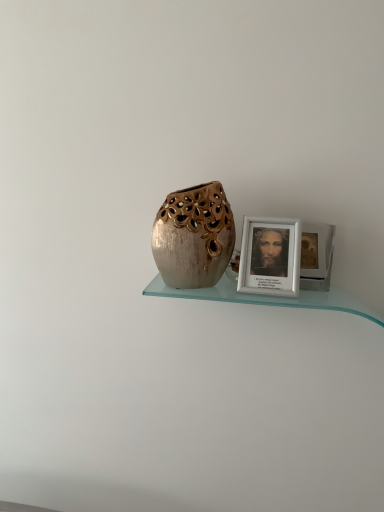
Question: Does white matte picture frame at upper right have a lesser width compared to shiny metallic vase at center?

Choices:
 (A) yes
 (B) no

Answer: (A)

Question: Would you consider white matte picture frame at upper right to be distant from shiny metallic vase at center?

Choices:
 (A) no
 (B) yes

Answer: (A)

Question: Can you confirm if white matte picture frame at upper right is positioned to the left of shiny metallic vase at center?

Choices:
 (A) no
 (B) yes

Answer: (A)

Question: Is white matte picture frame at upper right smaller than shiny metallic vase at center?

Choices:
 (A) yes
 (B) no

Answer: (A)

Question: Is white matte picture frame at upper right taller than shiny metallic vase at center?

Choices:
 (A) no
 (B) yes

Answer: (A)

Question: Does white matte picture frame at upper right lie behind shiny metallic vase at center?

Choices:
 (A) yes
 (B) no

Answer: (A)

Question: Would you say shiny metallic vase at center is outside white matte picture frame at upper right?

Choices:
 (A) no
 (B) yes

Answer: (B)

Question: Does shiny metallic vase at center have a larger size compared to white matte picture frame at upper right?

Choices:
 (A) no
 (B) yes

Answer: (B)

Question: Is the position of shiny metallic vase at center more distant than that of white matte picture frame at upper right?

Choices:
 (A) yes
 (B) no

Answer: (B)

Question: Is shiny metallic vase at center shorter than white matte picture frame at upper right?

Choices:
 (A) yes
 (B) no

Answer: (B)

Question: Considering the relative sizes of shiny metallic vase at center and white matte picture frame at upper right in the image provided, is shiny metallic vase at center thinner than white matte picture frame at upper right?

Choices:
 (A) no
 (B) yes

Answer: (A)

Question: Can you confirm if shiny metallic vase at center is wider than white matte picture frame at upper right?

Choices:
 (A) yes
 (B) no

Answer: (A)

Question: From the image's perspective, is white matte picture frame at upper right located above or below shiny metallic vase at center?

Choices:
 (A) below
 (B) above

Answer: (A)